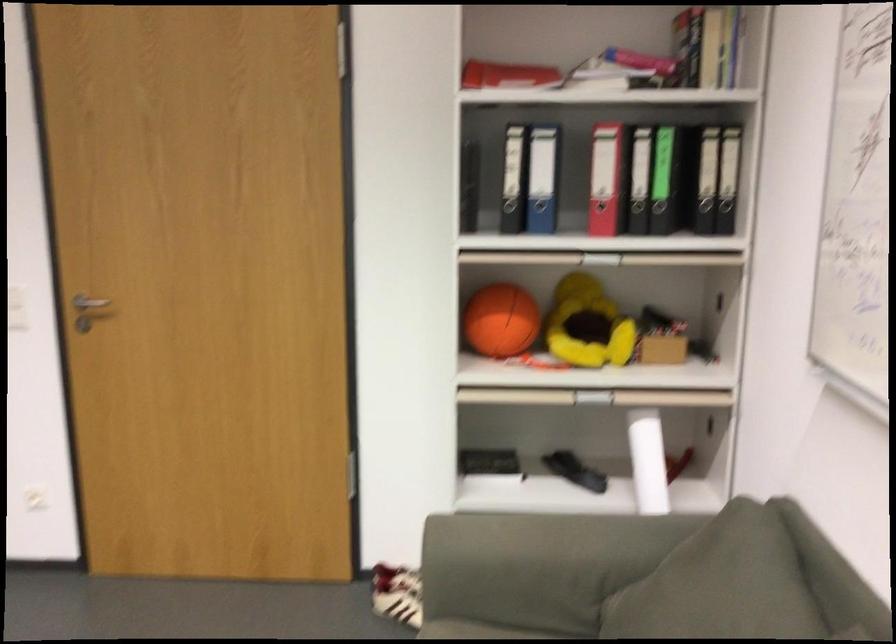
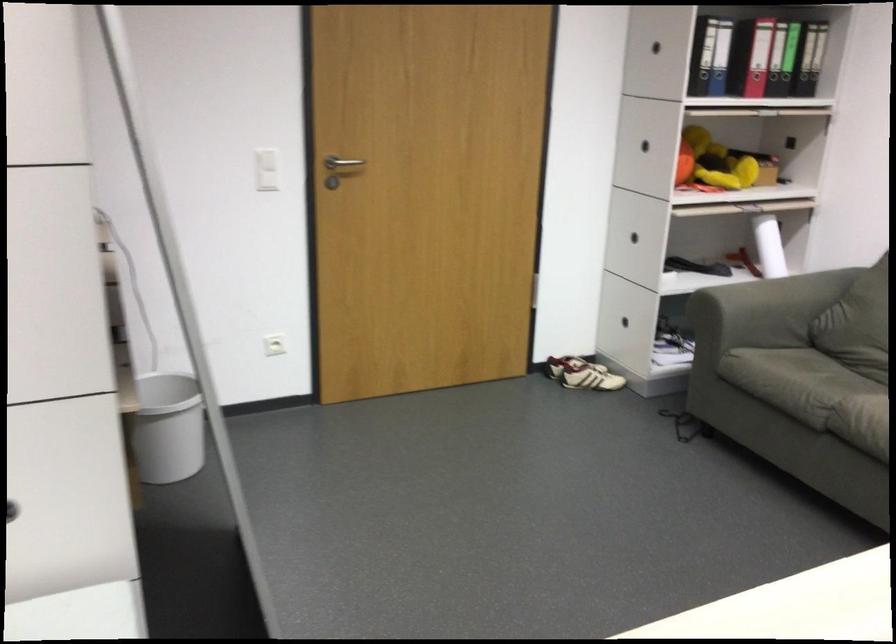
Question: In a continuous first-person perspective shot, in which direction is the camera moving?

Choices:
 (A) Left
 (B) Right
 (C) Forward
 (D) Backward

Answer: (A)